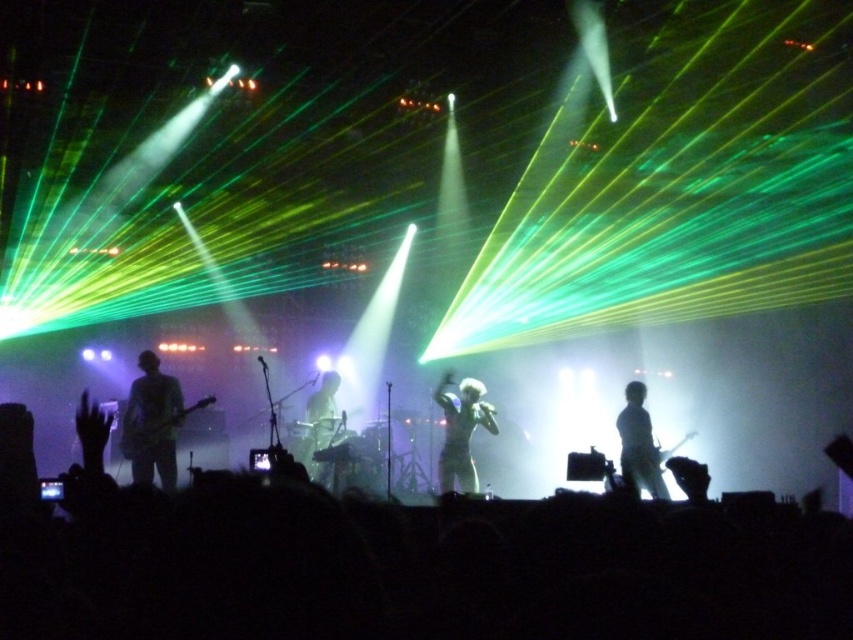
Question: Among these objects, which one is nearest to the camera?

Choices:
 (A) black matte crowd at lower center
 (B) matte black guitar at left
 (C) white matte/soft drum set at center
 (D) white metallic microphone at center

Answer: (A)

Question: Is black matte crowd at lower center bigger than white matte/soft drum set at center?

Choices:
 (A) no
 (B) yes

Answer: (B)

Question: Is black matte crowd at lower center thinner than matte black guitar at left?

Choices:
 (A) no
 (B) yes

Answer: (A)

Question: Which is farther from the white matte/soft drum set at center?

Choices:
 (A) black matte crowd at lower center
 (B) silvery metallic guitar at right

Answer: (A)

Question: Does black matte crowd at lower center appear on the right side of white matte/soft drum set at center?

Choices:
 (A) yes
 (B) no

Answer: (A)

Question: Which point is closer to the camera?

Choices:
 (A) white metallic microphone at center
 (B) matte black guitar at left

Answer: (B)